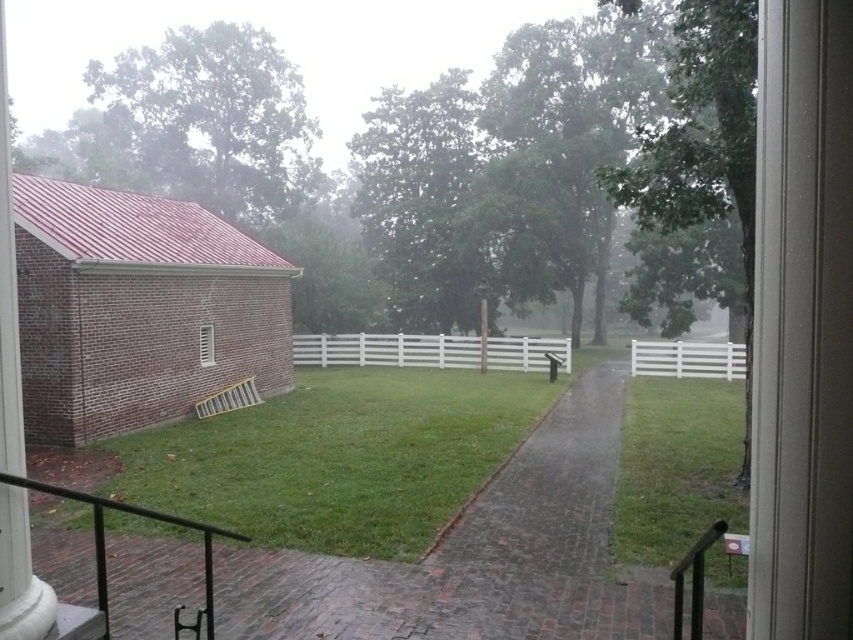
You are a gardener who needs to water the green grass at center. You are currently standing at the white painted wood window at lower left. Can you reach the grass with a standard garden hose that has a maximum reach of 10 feet without moving the hose? Please explain your reasoning.

The green grass at center and white painted wood window at lower left are 11.89 feet apart. Since the hose can only reach 10 feet, you cannot water the grass without moving the hose.

Consider the image. You are standing inside the building looking through the window. You see two points marked on the ground outside. The first point is at coordinates point (604,454) and the second is at point (210,333). Which point is closer to you from your current position inside the building?

Point (604,454) is in front of point (210,333), so it is closer to you.